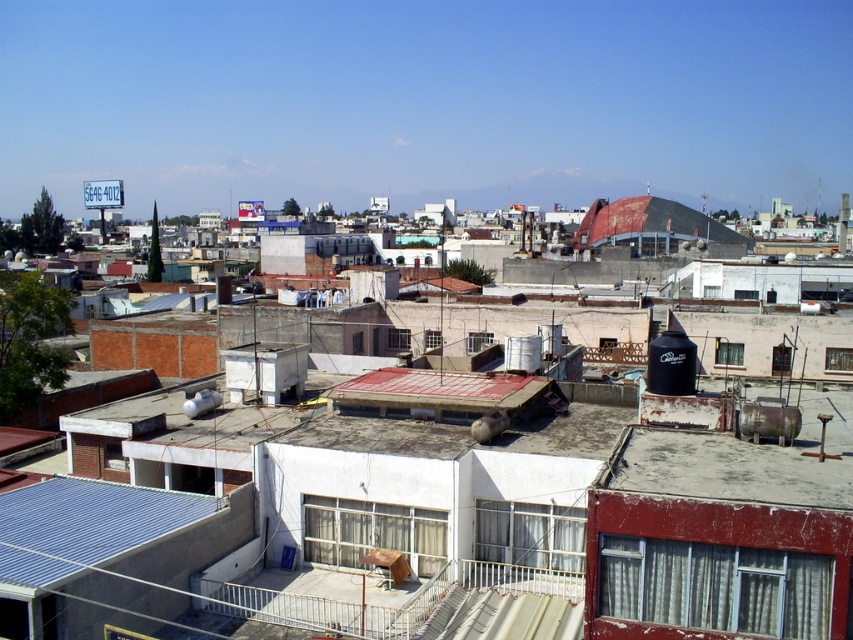
Question: Which point is farther to the camera?

Choices:
 (A) (447, 400)
 (B) (599, 227)

Answer: (B)

Question: Among these points, which one is farthest from the camera?

Choices:
 (A) (643, 198)
 (B) (408, 376)

Answer: (A)

Question: Can you confirm if red matte roof at center is positioned below rusty corrugated metal roof at center?

Choices:
 (A) no
 (B) yes

Answer: (B)

Question: Among these objects, which one is farthest from the camera?

Choices:
 (A) red matte roof at center
 (B) rusty corrugated metal roof at center

Answer: (B)

Question: Does red matte roof at center have a larger size compared to rusty corrugated metal roof at center?

Choices:
 (A) yes
 (B) no

Answer: (B)

Question: Is red matte roof at center to the left of rusty corrugated metal roof at center from the viewer's perspective?

Choices:
 (A) yes
 (B) no

Answer: (A)